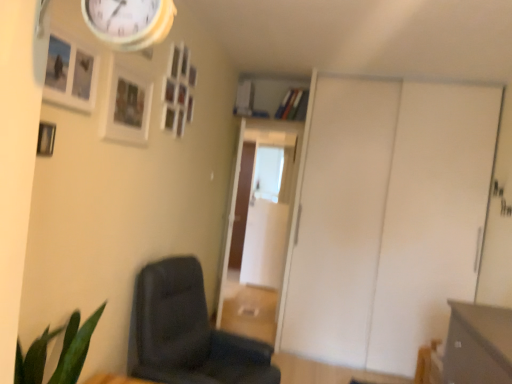
You are a GUI agent. You are given a task and a screenshot of the screen. Output one action in this format:
    pyautogui.click(x=<x>, y=<y>)
    Task: Click on the vacant area in front of transparent glass door at center, which is counted as the second glass door, starting from the back
    
    Given the screenshot: What is the action you would take?
    pyautogui.click(x=247, y=322)